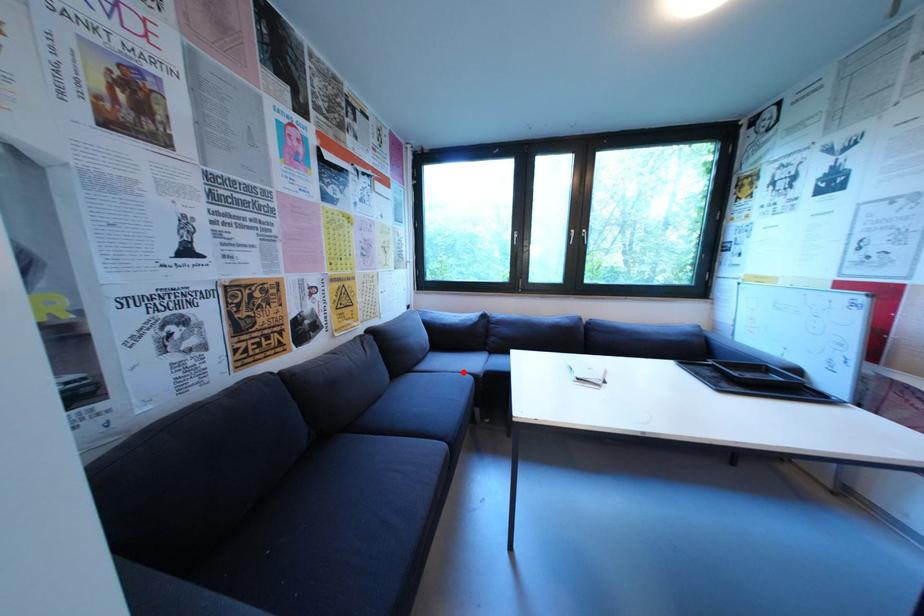
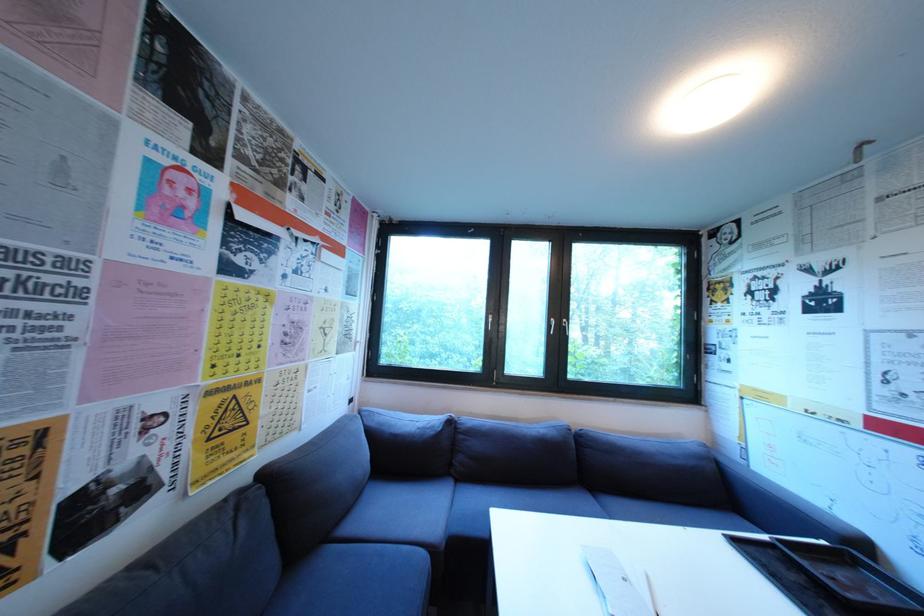
Locate, in the second image, the point that corresponds to the highlighted location in the first image.

(409, 538)